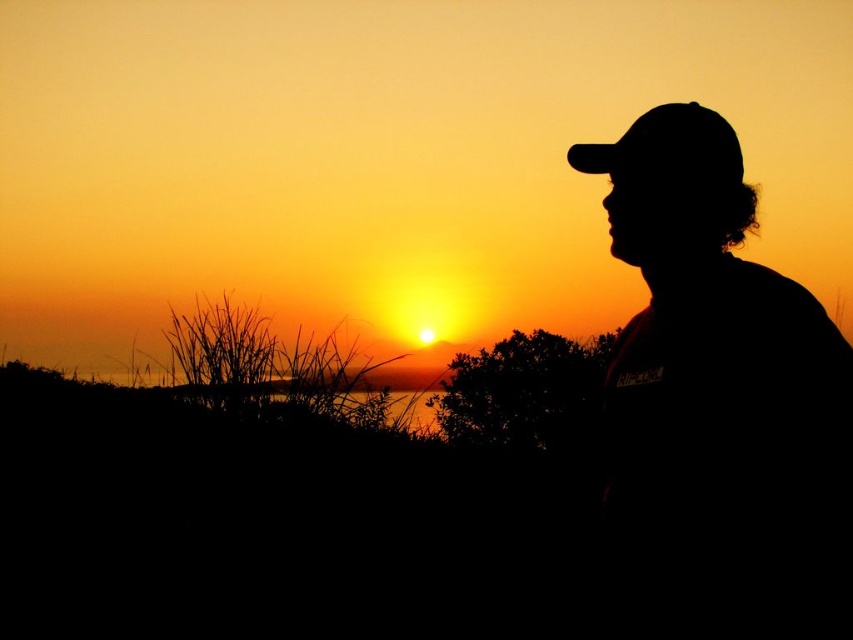
You are standing in the sunset scene and want to place a small flag at the point closest to you. Which point should you choose between point [718,525] and point [729,157]?

Point [718,525] is closer to the camera than point [729,157], so you should choose point [718,525] to place the flag.

From the picture: You are an observer trying to determine the position of the two caps in the sunset scene. Which of the two caps, the silhouette cap at right or the black matte baseball hat at upper right, is closer to you?

The silhouette cap at right is closer to the viewer than the black matte baseball hat at upper right.